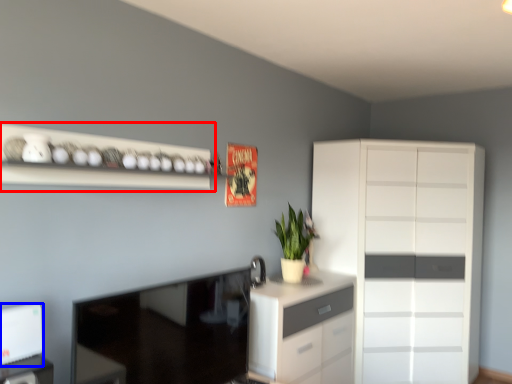
Question: Among these objects, which one is farthest to the camera, shelf (highlighted by a red box) or appliance (highlighted by a blue box)?

Choices:
 (A) shelf
 (B) appliance

Answer: (A)